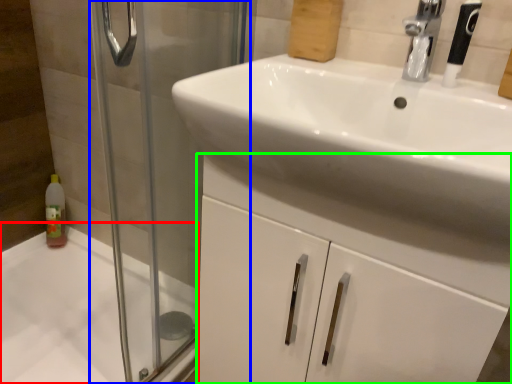
Question: Estimate the real-world distances between objects in this image. Which object is closer to bath (highlighted by a red box), screen door (highlighted by a blue box) or bathroom cabinet (highlighted by a green box)?

Choices:
 (A) screen door
 (B) bathroom cabinet

Answer: (A)